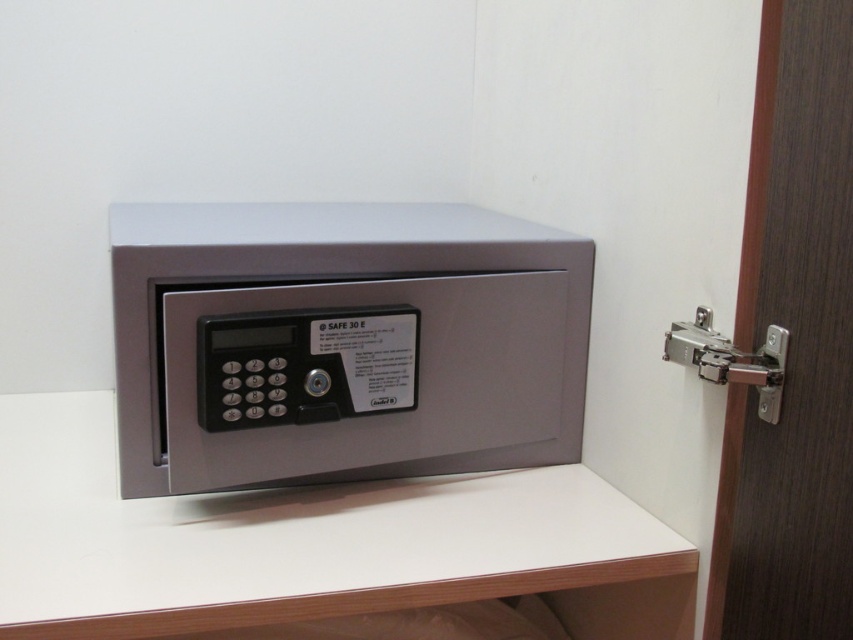
Consider the image. You are standing in front of a desk and need to locate the satin metallic safe at center. Based on the coordinates given, can you determine if it is positioned closer to the left or right side of the desk?

The satin metallic safe at center is positioned at coordinates point (341, 342). Since the x coordinate is 0.537, which is just over halfway from the left edge, it is slightly closer to the right side of the desk.

You are trying to close the satin metallic safe at center and the silver metallic hinge at right. Which object is closer to the edge of the wooden surface?

The silver metallic hinge at right is closer to the edge of the wooden surface because the satin metallic safe at center is positioned over it, meaning it is placed farther from the edge compared to the hinge.

You are a delivery person who needs to place a package on the desk where the satin metallic safe at center is located. The package is 1 meter long. Can you fit the package on the desk without moving the safe?

The satin metallic safe at center is 80.81 centimeters away from the camera, but the desk dimensions are not provided. Without knowing the desk length, it is impossible to determine if the package will fit.